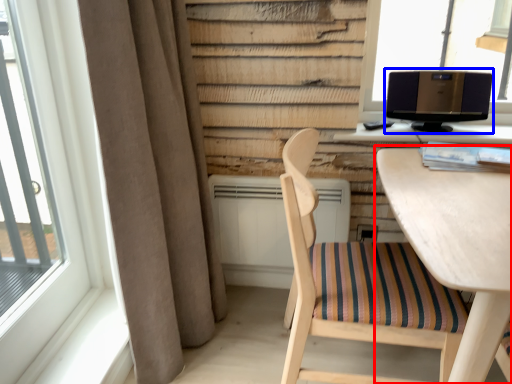
Question: Which of the following is the closest to the observer, table (highlighted by a red box) or computer monitor (highlighted by a blue box)?

Choices:
 (A) table
 (B) computer monitor

Answer: (A)